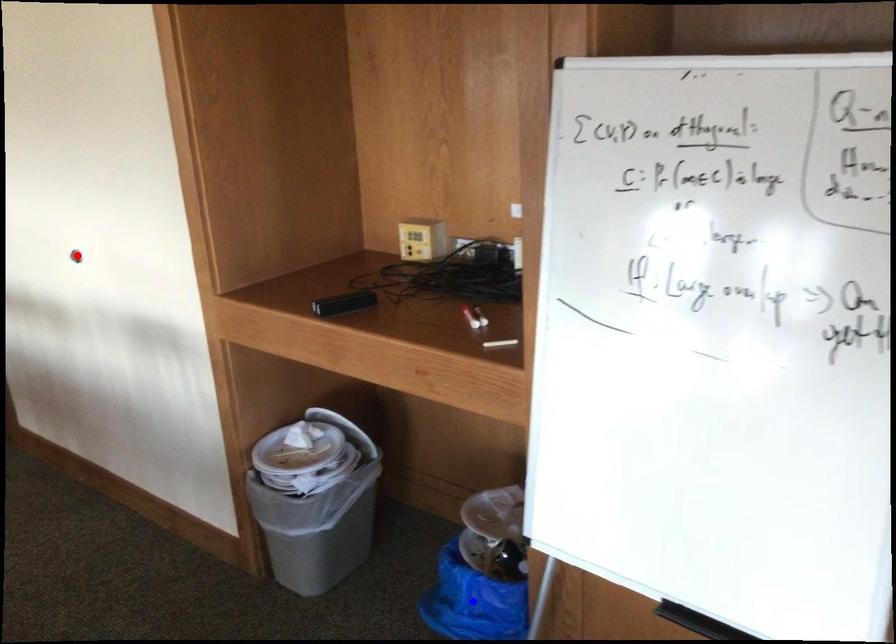
Question: Two points are marked on the image. Which point is closer to the camera?

Choices:
 (A) Blue point is closer.
 (B) Red point is closer.

Answer: (A)